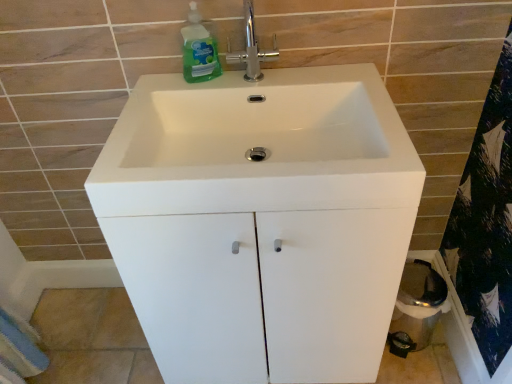
The width and height of the screenshot is (512, 384). Find the location of `blank space to the left of green translucent liquid at upper left`. blank space to the left of green translucent liquid at upper left is located at coordinates (156, 96).